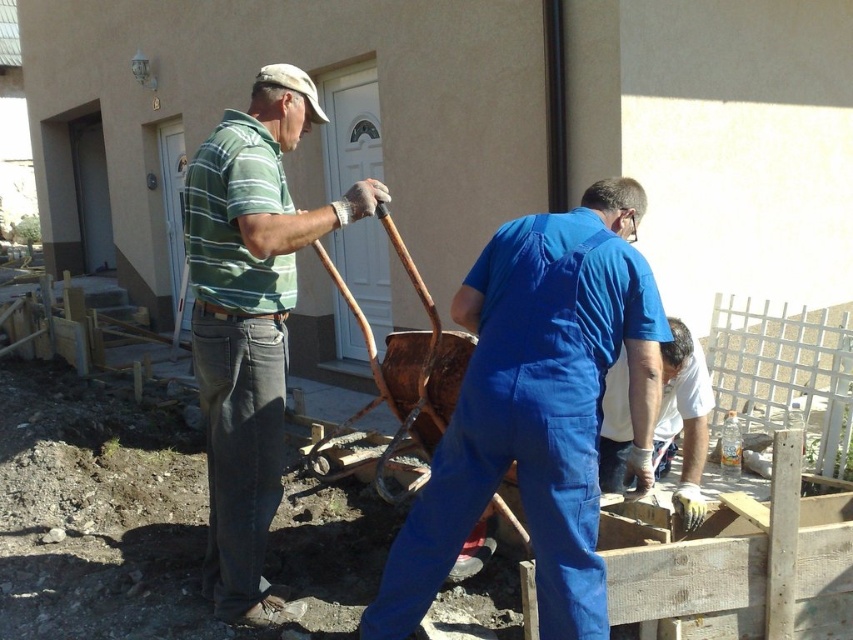
Which is in front, point (283, 92) or point (601, 436)?

Point (283, 92)

Measure the distance from green striped shirt at center to white matte gloves at lower right.

green striped shirt at center is 1.41 meters from white matte gloves at lower right.

Is point (195, 276) closer to viewer compared to point (699, 522)?

No.

Image resolution: width=853 pixels, height=640 pixels. I want to click on green striped shirt at center, so click(x=250, y=323).

Does blue coveralls at center have a smaller size compared to green striped shirt at center?

Yes, blue coveralls at center is smaller than green striped shirt at center.

Which is in front, point (544, 241) or point (279, 108)?

Positioned in front is point (544, 241).

This screenshot has width=853, height=640. In order to click on blue coveralls at center in this screenshot , I will do `click(537, 408)`.

Who is more forward, (495, 468) or (676, 508)?

Positioned in front is point (495, 468).

Who is taller, blue coveralls at center or white matte gloves at lower right?

Standing taller between the two is blue coveralls at center.

Describe the element at coordinates (537, 408) in the screenshot. I see `blue coveralls at center` at that location.

Where is `blue coveralls at center`? blue coveralls at center is located at coordinates (537, 408).